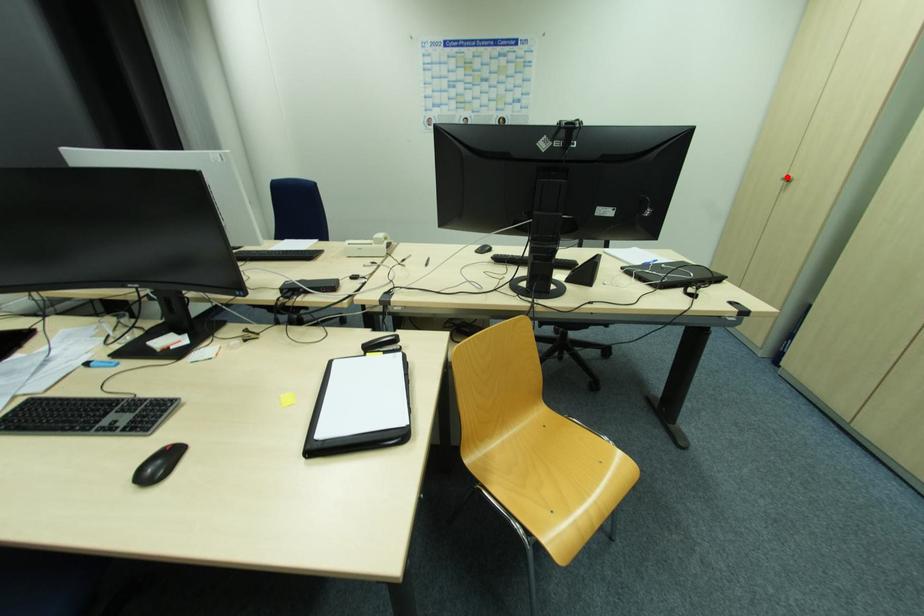
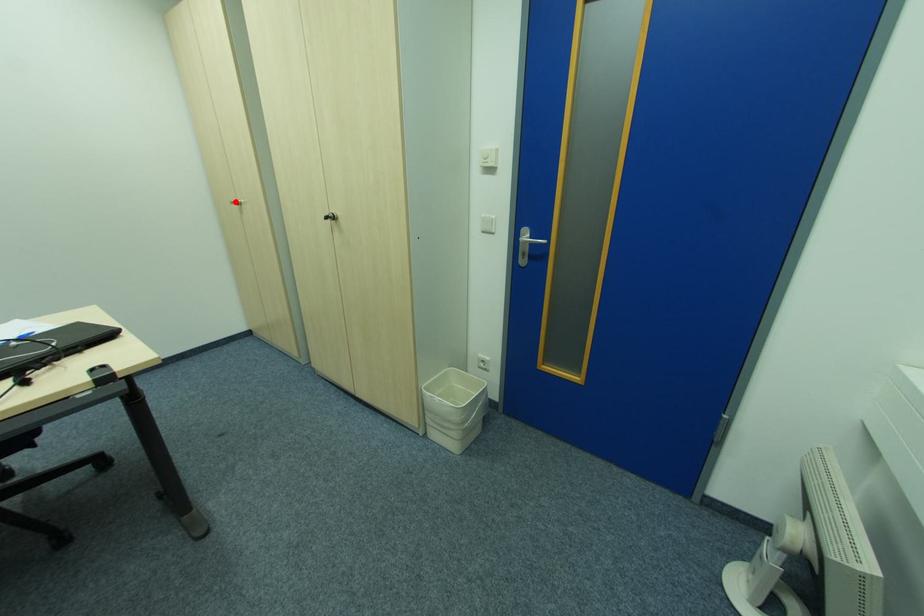
I am providing you with two images of the same scene from different viewpoints. A red point is marked on the first image and another point is marked on the second image. Do the highlighted points in image1 and image2 indicate the same real-world spot?

Yes